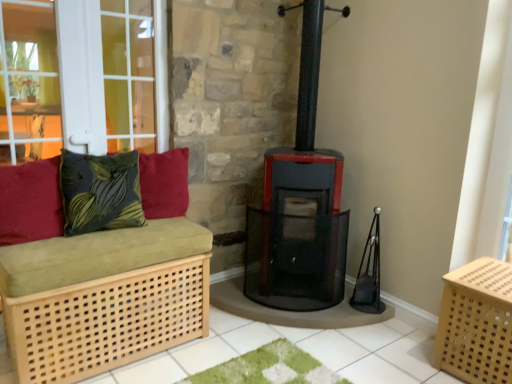
At what (x,y) coordinates should I click in order to perform the action: click on vacant point to the right of light wood/light brown bench at left. Please return your answer as a coordinate pair (x, y). Looking at the image, I should click on (229, 350).